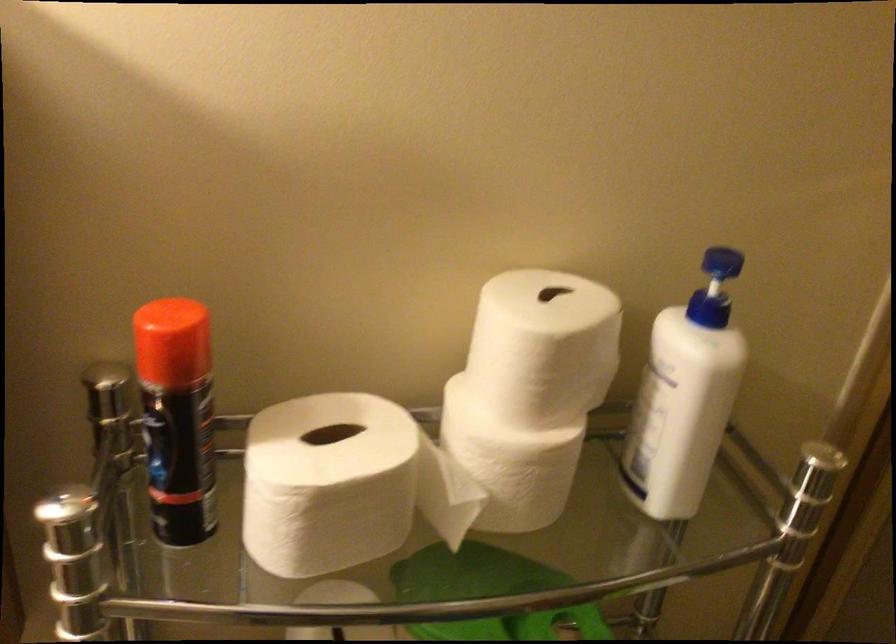
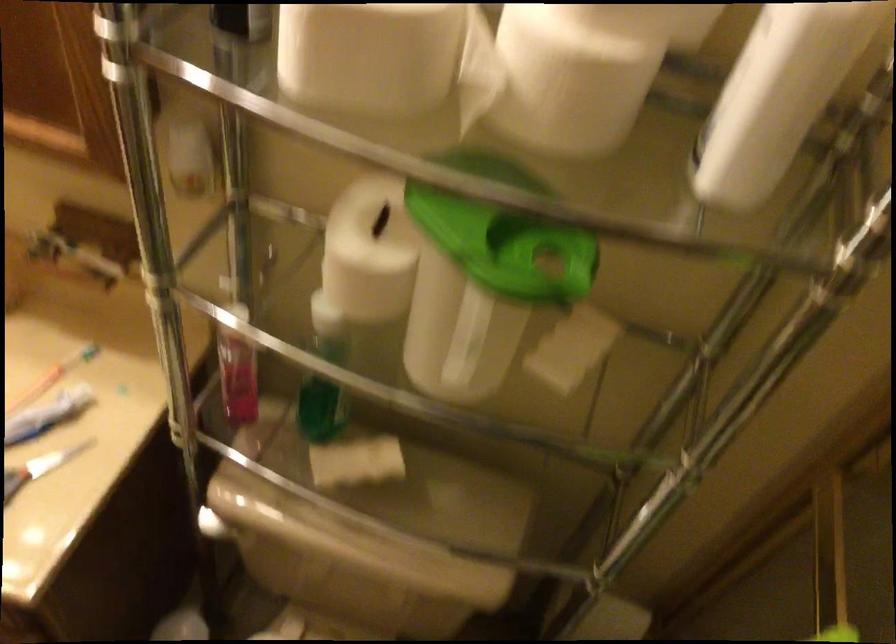
Where in the second image is the point corresponding to point (545, 464) from the first image?

(575, 73)